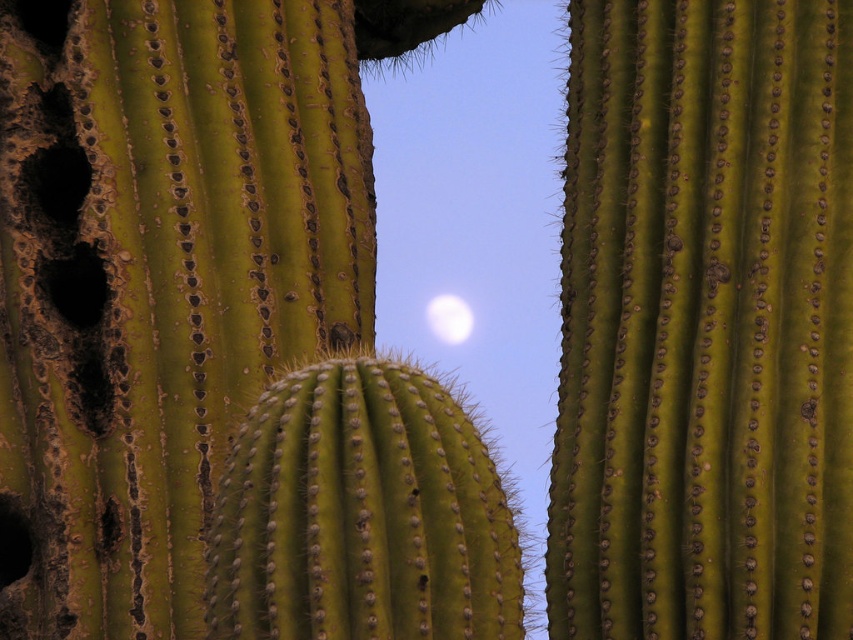
Does point (279, 452) come farther from viewer compared to point (448, 294)?

No, it is not.

Can you confirm if green spiny cactus at center is wider than white translucent moon at upper center?

Correct, the width of green spiny cactus at center exceeds that of white translucent moon at upper center.

Does point (328, 438) come behind point (450, 314)?

No.

The image size is (853, 640). Identify the location of green spiny cactus at center. (361, 515).